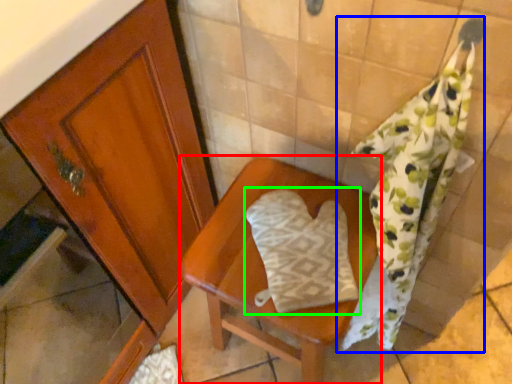
Question: Which is nearer to the furniture (highlighted by a red box)? bath towel (highlighted by a blue box) or throw pillow (highlighted by a green box).

Choices:
 (A) bath towel
 (B) throw pillow

Answer: (B)